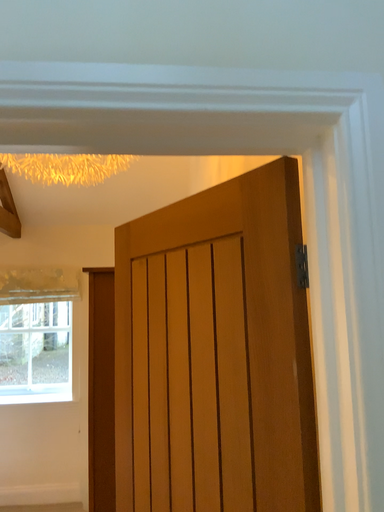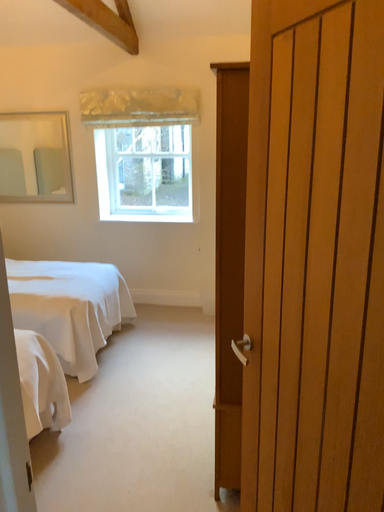
Question: Which way did the camera rotate in the video?

Choices:
 (A) rotated upward
 (B) rotated downward

Answer: (B)